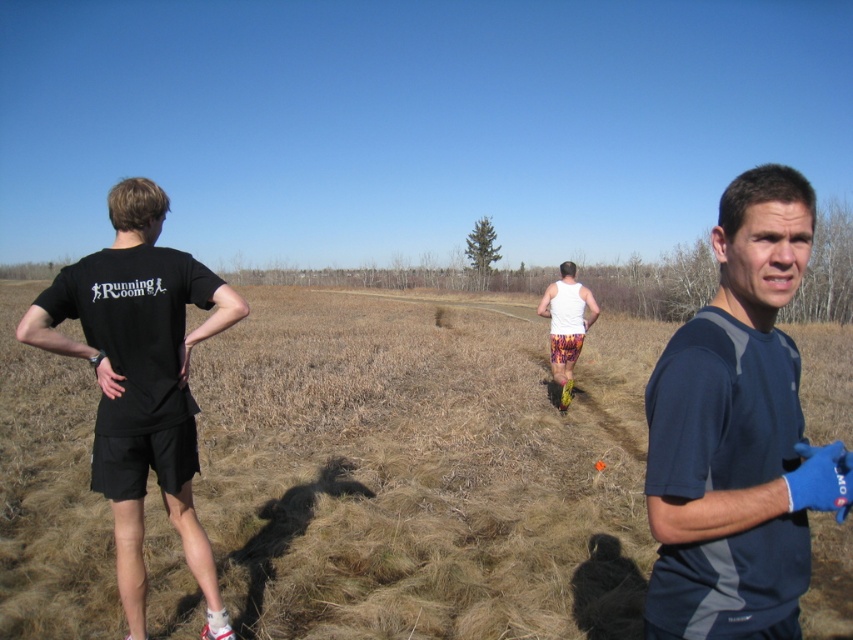
You are a photographer setting up a shoot on a sunny day. You have two subjects in the frame. The first is the brown dry grass at center, and the second is the blue fabric shirt at center. Which subject will appear taller in the photo?

The blue fabric shirt at center appears taller than the brown dry grass at center in the photo because the brown dry grass at center is not as tall as the blue fabric shirt at center.